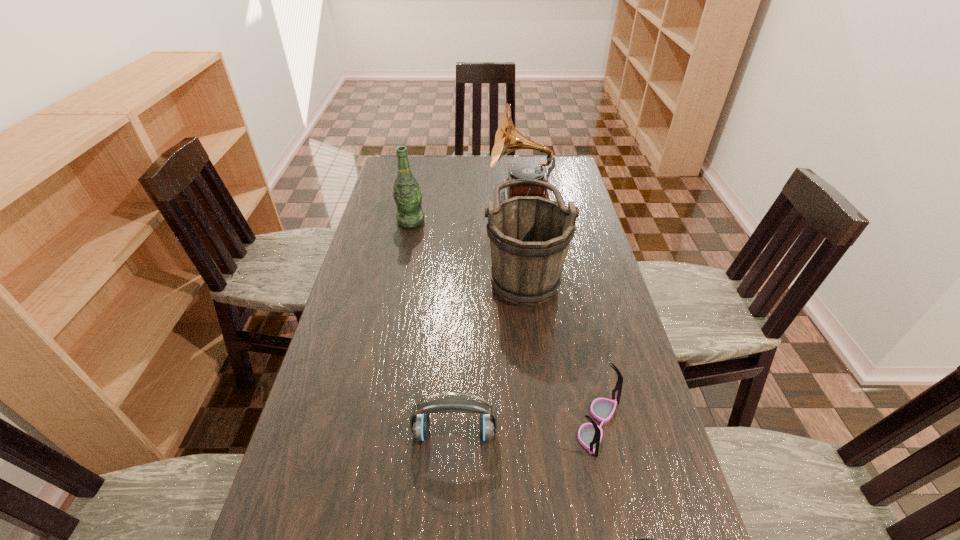
Where is `phonograph_record`? The width and height of the screenshot is (960, 540). phonograph_record is located at coordinates (507, 139).

You are a GUI agent. You are given a task and a screenshot of the screen. Output one action in this format:
    pyautogui.click(x=<x>, y=<y>)
    Task: Click on the farthest object
    Image resolution: width=960 pixels, height=540 pixels.
    Given the screenshot: What is the action you would take?
    pyautogui.click(x=507, y=139)

Image resolution: width=960 pixels, height=540 pixels. Identify the location of beer bottle. (408, 196).

This screenshot has height=540, width=960. Identify the location of the leftmost object. (408, 196).

This screenshot has height=540, width=960. I want to click on bucket, so click(x=529, y=236).

At what (x,y) coordinates should I click in order to perform the action: click on headset. Please return your answer as a coordinate pair (x, y). This screenshot has height=540, width=960. Looking at the image, I should click on (419, 420).

Where is `the farther spectacles`? The height and width of the screenshot is (540, 960). the farther spectacles is located at coordinates (590, 434).

The image size is (960, 540). What are the coordinates of `blank space located 0.240m on the horn of the tallest object` in the screenshot? It's located at (431, 192).

Where is `vacant position located on the horn of the tallest object`? vacant position located on the horn of the tallest object is located at coordinates (395, 192).

Locate an element on the screen. The width and height of the screenshot is (960, 540). vacant space located 0.100m on the horn of the tallest object is located at coordinates (466, 192).